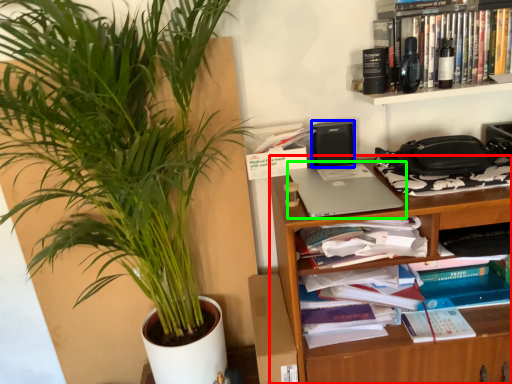
Question: Estimate the real-world distances between objects in this image. Which object is closer to shelf (highlighted by a red box), speaker (highlighted by a blue box) or laptop (highlighted by a green box)?

Choices:
 (A) speaker
 (B) laptop

Answer: (B)